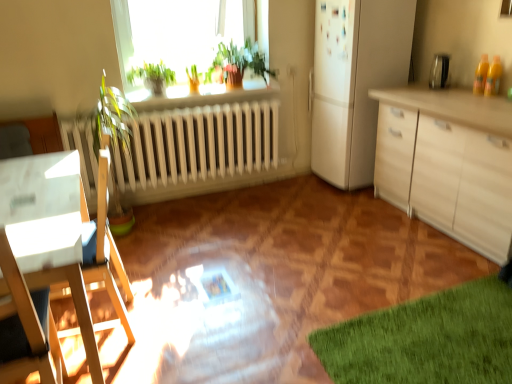
Question: Which direction should I rotate to face green leafy plant at upper center, which is the second plant in left-to-right order, — up or down?

Choices:
 (A) down
 (B) up

Answer: (B)

Question: Is green leafy plant at upper center outside white wood desk at left?

Choices:
 (A) yes
 (B) no

Answer: (A)

Question: Would you say green leafy plant at upper center contains white wood desk at left?

Choices:
 (A) no
 (B) yes

Answer: (A)

Question: From the image's perspective, is green leafy plant at upper center below white wood desk at left?

Choices:
 (A) yes
 (B) no

Answer: (B)

Question: Is green leafy plant at upper center aimed at white wood desk at left?

Choices:
 (A) no
 (B) yes

Answer: (A)

Question: Is green leafy plant at upper center next to white wood desk at left?

Choices:
 (A) no
 (B) yes

Answer: (A)

Question: Is green leafy plant at upper center shorter than white wood desk at left?

Choices:
 (A) yes
 (B) no

Answer: (A)

Question: Is white wood desk at left bigger than green leafy plant at upper center, which is the first plant from right to left?

Choices:
 (A) yes
 (B) no

Answer: (A)

Question: Is white wood desk at left facing towards green leafy plant at upper center, which is the second plant in left-to-right order?

Choices:
 (A) yes
 (B) no

Answer: (B)

Question: Is white wood desk at left touching green leafy plant at upper center, which is the second plant in left-to-right order?

Choices:
 (A) yes
 (B) no

Answer: (B)

Question: Is white wood desk at left in front of green leafy plant at upper center, which is the first plant from right to left?

Choices:
 (A) yes
 (B) no

Answer: (A)

Question: Is white wood desk at left taller than green leafy plant at upper center, which is the second plant in left-to-right order?

Choices:
 (A) no
 (B) yes

Answer: (B)

Question: From a real-world perspective, is white wood desk at left under green leafy plant at upper center, which is the first plant from right to left?

Choices:
 (A) no
 (B) yes

Answer: (B)

Question: Is green matte plant at upper center, which is the second plant in right-to-left order, shorter than white matte refrigerator at upper right?

Choices:
 (A) no
 (B) yes

Answer: (B)